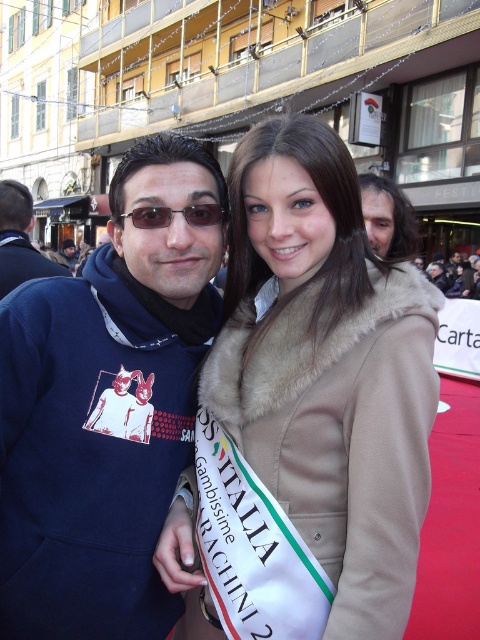
You are a photographer setting up for a group photo. The two subjects are wearing the beige fur coat at center and the navy blue hoodie at left. If your camera has a depth of field that can focus clearly on objects within 28 inches of each other, will both subjects be in focus?

The distance between the beige fur coat at center and the navy blue hoodie at left is 27.89 inches, which is within the 28 inches depth of field. Therefore, both subjects will be in focus.

You are a photographer at the event and need to adjust your camera to focus on both the beige fur coat at center and the navy blue hoodie at left. Which object should you focus on first if you want to ensure both are in focus without moving the camera?

The beige fur coat at center is below the navy blue hoodie at left, so you should focus on the navy blue hoodie at left first because it is closer to the camera. This will ensure the depth of field includes both objects.

You are a photographer at the event and need to ensure both the navy blue hoodie at left and the matte black sunglasses at center are visible in your shot. Given that the camera has a limited zoom range, which object should you prioritize framing closer to the center to ensure both fit in the frame?

The navy blue hoodie at left is larger in size than the matte black sunglasses at center. To ensure both fit in the frame, prioritize framing the navy blue hoodie at left closer to the center since it requires more space due to its larger size.